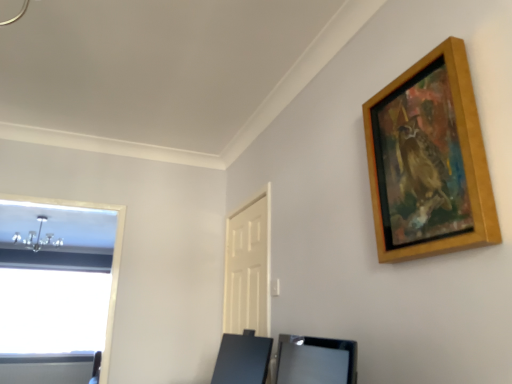
Question: Which direction should I rotate to look at satin black vanity at lower center, arranged as the second vanity when viewed from the back?

Choices:
 (A) right
 (B) left

Answer: (A)

Question: Is there a large distance between black glossy vanity at lower center, which is the 2th vanity from front to back, and satin black vanity at lower center, which is the first vanity in front-to-back order?

Choices:
 (A) no
 (B) yes

Answer: (A)

Question: Considering the relative sizes of black glossy vanity at lower center, which is the 2th vanity from front to back, and satin black vanity at lower center, arranged as the second vanity when viewed from the back, in the image provided, is black glossy vanity at lower center, which is the 2th vanity from front to back, thinner than satin black vanity at lower center, arranged as the second vanity when viewed from the back,?

Choices:
 (A) no
 (B) yes

Answer: (A)

Question: Is black glossy vanity at lower center, the 1th vanity viewed from the back, at the right side of satin black vanity at lower center, arranged as the second vanity when viewed from the back?

Choices:
 (A) yes
 (B) no

Answer: (B)

Question: Is black glossy vanity at lower center, which is the 2th vanity from front to back, oriented towards satin black vanity at lower center, which is the first vanity in front-to-back order?

Choices:
 (A) yes
 (B) no

Answer: (B)

Question: Does black glossy vanity at lower center, which is the 2th vanity from front to back, come behind satin black vanity at lower center, which is the first vanity in front-to-back order?

Choices:
 (A) no
 (B) yes

Answer: (B)

Question: Is black glossy vanity at lower center, the 1th vanity viewed from the back, positioned with its back to satin black vanity at lower center, which is the first vanity in front-to-back order?

Choices:
 (A) yes
 (B) no

Answer: (B)

Question: Does satin black vanity at lower center, arranged as the second vanity when viewed from the back, come in front of wooden picture frame at upper right?

Choices:
 (A) no
 (B) yes

Answer: (A)

Question: Is satin black vanity at lower center, which is the first vanity in front-to-back order, not near wooden picture frame at upper right?

Choices:
 (A) yes
 (B) no

Answer: (B)

Question: Is satin black vanity at lower center, which is the first vanity in front-to-back order, looking in the opposite direction of wooden picture frame at upper right?

Choices:
 (A) yes
 (B) no

Answer: (B)

Question: From a real-world perspective, is satin black vanity at lower center, arranged as the second vanity when viewed from the back, over wooden picture frame at upper right?

Choices:
 (A) no
 (B) yes

Answer: (A)

Question: Could you tell me if satin black vanity at lower center, which is the first vanity in front-to-back order, is facing wooden picture frame at upper right?

Choices:
 (A) yes
 (B) no

Answer: (B)

Question: Does satin black vanity at lower center, arranged as the second vanity when viewed from the back, have a lesser height compared to wooden picture frame at upper right?

Choices:
 (A) no
 (B) yes

Answer: (B)

Question: Considering the relative sizes of wooden picture frame at upper right and black glossy vanity at lower center, the 1th vanity viewed from the back, in the image provided, is wooden picture frame at upper right smaller than black glossy vanity at lower center, the 1th vanity viewed from the back,?

Choices:
 (A) yes
 (B) no

Answer: (A)